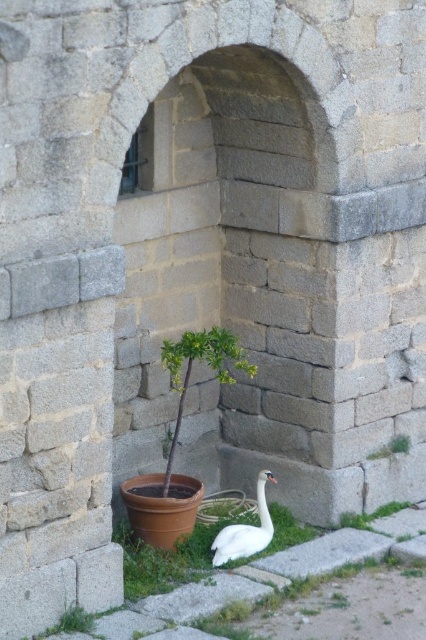
Question: Which point is farther to the camera?

Choices:
 (A) (371, 452)
 (B) (180, 388)
 (C) (259, 540)

Answer: (B)

Question: Does green leafy plant at center appear under white glossy swan at lower center?

Choices:
 (A) yes
 (B) no

Answer: (B)

Question: Based on their relative distances, which object is farther from the white glossy swan at lower center?

Choices:
 (A) green leafy plant at lower right
 (B) green leafy plant at center

Answer: (A)

Question: Is green leafy plant at center to the left of green leafy plant at lower right from the viewer's perspective?

Choices:
 (A) no
 (B) yes

Answer: (B)

Question: Which of the following is the farthest from the observer?

Choices:
 (A) (247, 548)
 (B) (175, 445)
 (C) (405, 440)

Answer: (C)

Question: Is white glossy swan at lower center thinner than green leafy plant at lower right?

Choices:
 (A) no
 (B) yes

Answer: (A)